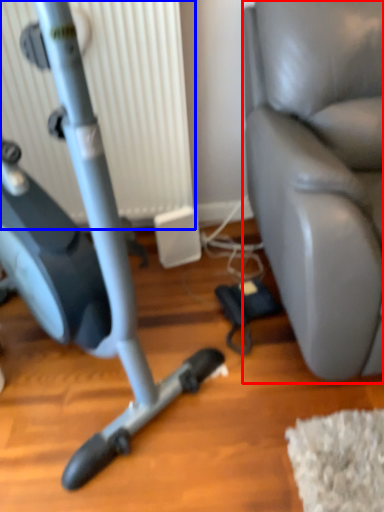
Question: Which point is further to the camera, swivel chair (highlighted by a red box) or radiator (highlighted by a blue box)?

Choices:
 (A) swivel chair
 (B) radiator

Answer: (B)